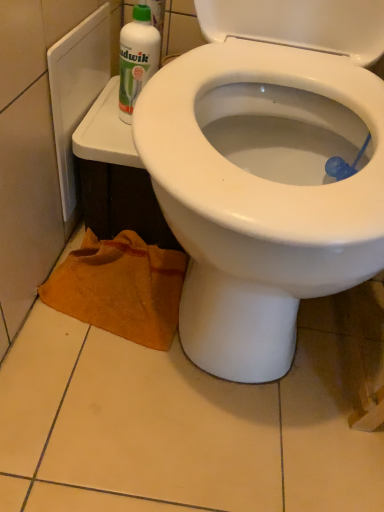
Image resolution: width=384 pixels, height=512 pixels. Find the location of `orange towel at lower left`. orange towel at lower left is located at coordinates (120, 288).

You are a GUI agent. You are given a task and a screenshot of the screen. Output one action in this format:
    pyautogui.click(x=<x>, y=<y>)
    Task: Click on the white plastic bottle at upper left
    This screenshot has height=512, width=384.
    Given the screenshot: What is the action you would take?
    pyautogui.click(x=137, y=58)

The width and height of the screenshot is (384, 512). Find the location of `white glossy bidet at center`. white glossy bidet at center is located at coordinates (260, 197).

Between orange towel at lower left and white glossy bidet at center, which one has more height?

With more height is white glossy bidet at center.

From the picture: Would you say orange towel at lower left is inside or outside white glossy bidet at center?

orange towel at lower left can be found inside white glossy bidet at center.

From a real-world perspective, is orange towel at lower left beneath white glossy bidet at center?

Yes, from a real-world perspective, orange towel at lower left is beneath white glossy bidet at center.

Is orange towel at lower left smaller than white glossy bidet at center?

Yes.

From a real-world perspective, is white glossy bidet at center on top of orange towel at lower left?

Yes.

How different are the orientations of white glossy bidet at center and orange towel at lower left in degrees?

white glossy bidet at center and orange towel at lower left are facing 0.00126 degrees away from each other.

From the picture: From the image's perspective, which one is positioned higher, white glossy bidet at center or orange towel at lower left?

white glossy bidet at center appears higher in the image.

Is white glossy bidet at center not near orange towel at lower left?

No, white glossy bidet at center is not far away from orange towel at lower left.

Considering the relative sizes of white plastic bottle at upper left and orange towel at lower left in the image provided, is white plastic bottle at upper left shorter than orange towel at lower left?

No.

Is white plastic bottle at upper left at the left side of orange towel at lower left?

No.

Is white plastic bottle at upper left in front of or behind orange towel at lower left in the image?

Visually, white plastic bottle at upper left is located in front of orange towel at lower left.

Is orange towel at lower left not within white plastic bottle at upper left?

orange towel at lower left is positioned outside white plastic bottle at upper left.

In the image, is orange towel at lower left positioned in front of or behind white plastic bottle at upper left?

orange towel at lower left is behind white plastic bottle at upper left.

Who is bigger, orange towel at lower left or white plastic bottle at upper left?

With larger size is orange towel at lower left.

Between orange towel at lower left and white plastic bottle at upper left, which one has less height?

With less height is orange towel at lower left.

Is white glossy bidet at center looking in the opposite direction of white plastic bottle at upper left?

white glossy bidet at center is not turned away from white plastic bottle at upper left.

Would you say white glossy bidet at center is outside white plastic bottle at upper left?

white glossy bidet at center lies outside white plastic bottle at upper left's area.

Considering the sizes of objects white glossy bidet at center and white plastic bottle at upper left in the image provided, who is smaller, white glossy bidet at center or white plastic bottle at upper left?

white plastic bottle at upper left.

Is white glossy bidet at center far from white plastic bottle at upper left?

No, white glossy bidet at center is in close proximity to white plastic bottle at upper left.

Considering the relative sizes of white plastic bottle at upper left and white glossy bidet at center in the image provided, is white plastic bottle at upper left smaller than white glossy bidet at center?

Correct, white plastic bottle at upper left occupies less space than white glossy bidet at center.

Between point (153, 39) and point (232, 151), which one is positioned behind?

The point (232, 151) is more distant.

From the picture: Who is shorter, white plastic bottle at upper left or white glossy bidet at center?

white plastic bottle at upper left.

This screenshot has height=512, width=384. In order to click on cleaning product located on the left of white glossy bidet at center in this screenshot , I will do `click(137, 58)`.

Image resolution: width=384 pixels, height=512 pixels. In order to click on material that appears behind the white glossy bidet at center in this screenshot , I will do `click(120, 288)`.

You are a GUI agent. You are given a task and a screenshot of the screen. Output one action in this format:
    pyautogui.click(x=<x>, y=<y>)
    Task: Click on the bidet on the right of orange towel at lower left
    
    Given the screenshot: What is the action you would take?
    pyautogui.click(x=260, y=197)

From the image, which object appears to be nearer to white glossy bidet at center, white plastic bottle at upper left or orange towel at lower left?

Based on the image, orange towel at lower left appears to be nearer to white glossy bidet at center.

Based on their spatial positions, is orange towel at lower left or white glossy bidet at center further from white plastic bottle at upper left?

white glossy bidet at center lies further to white plastic bottle at upper left than the other object.

Considering their positions, is white plastic bottle at upper left positioned further to orange towel at lower left than white glossy bidet at center?

white plastic bottle at upper left is positioned further to the anchor orange towel at lower left.

When comparing their distances from white plastic bottle at upper left, does white glossy bidet at center or orange towel at lower left seem closer?

Based on the image, orange towel at lower left appears to be nearer to white plastic bottle at upper left.

Looking at the image, which one is located further to white glossy bidet at center, orange towel at lower left or white plastic bottle at upper left?

white plastic bottle at upper left lies further to white glossy bidet at center than the other object.

Looking at the image, which one is located closer to orange towel at lower left, white glossy bidet at center or white plastic bottle at upper left?

Based on the image, white glossy bidet at center appears to be nearer to orange towel at lower left.

Locate an element on the screen. cleaning product between white glossy bidet at center and orange towel at lower left in the front-back direction is located at coordinates (137, 58).